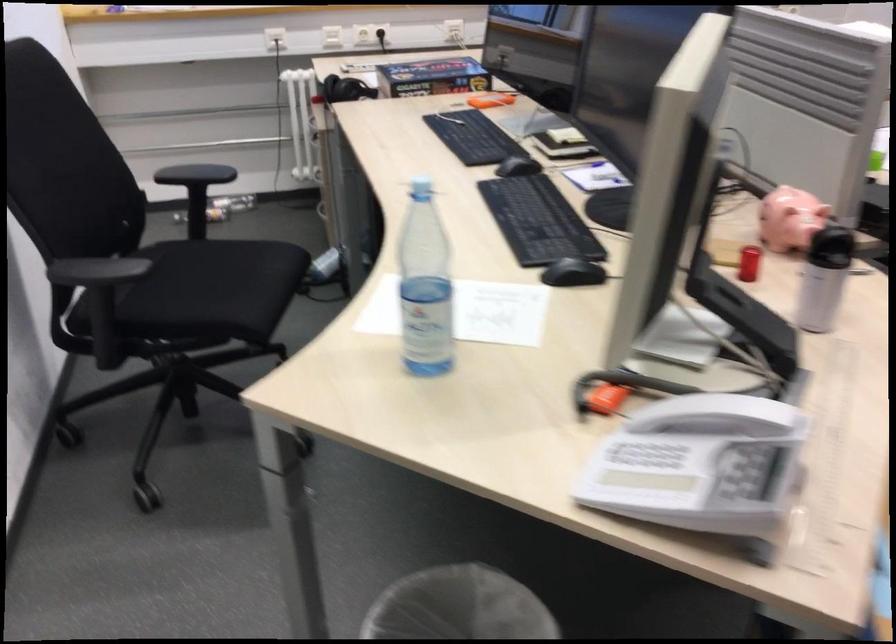
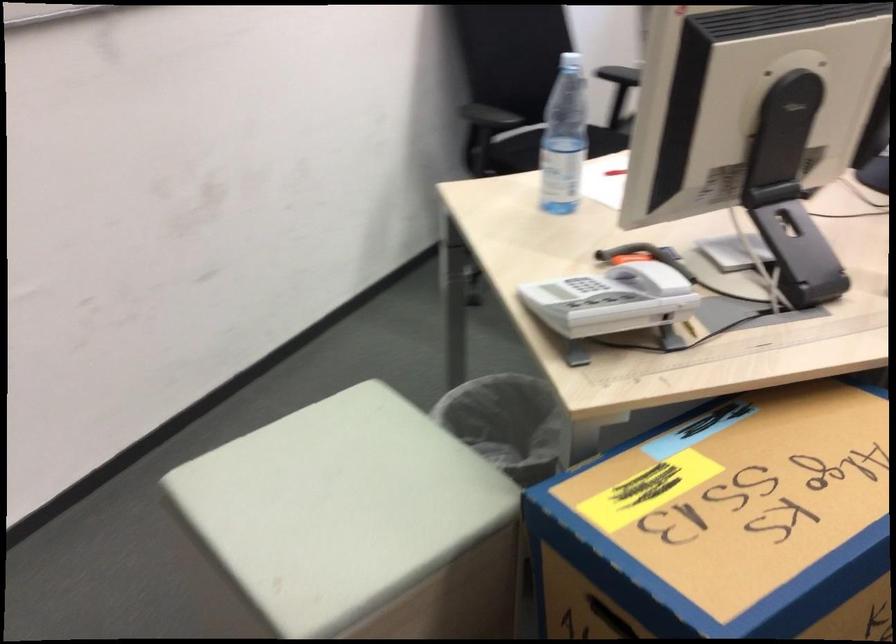
The point at [728,404] is marked in the first image. Where is the corresponding point in the second image?

(648, 268)